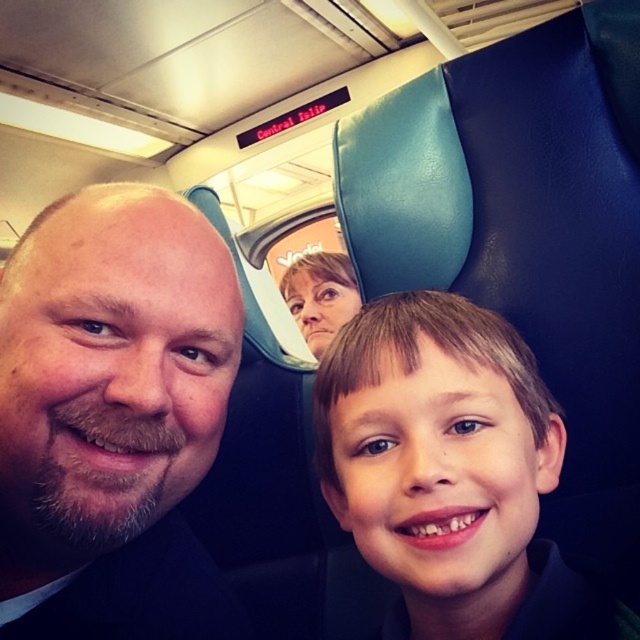
You are a photographer trying to capture a closeup shot of the brown beard at center and the smooth skin face at center in the train carriage scene. Based on their sizes, which one would appear more detailed in the photo?

The brown beard at center has a larger size compared to the smooth skin face at center, so it would appear more detailed in the photo.

You are a photographer trying to capture a group photo of the brown beard at center and the smooth skin face at center in the train carriage. Given their heights, which person should you position closer to the camera to ensure both are fully visible in the photo?

The brown beard at center is much taller than the smooth skin face at center, so to ensure both are fully visible in the photo, you should position the shorter smooth skin face at center closer to the camera.

Where is the brown beard at center located in the image?

The brown beard at center is located at point 0.648 on the x axis and 0.178 on the y axis.